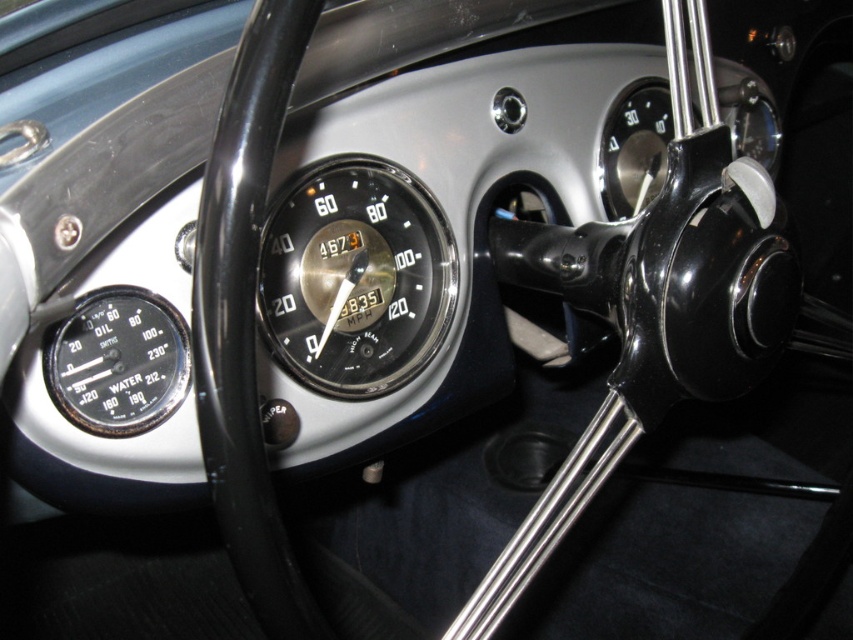
Question: Is shiny chrome speedometer at center bigger than black metallic gauge at left?

Choices:
 (A) no
 (B) yes

Answer: (B)

Question: Which object is farther from the camera taking this photo?

Choices:
 (A) black metallic gauge at left
 (B) shiny chrome speedometer at center

Answer: (B)

Question: Is shiny chrome speedometer at center smaller than black metallic gauge at left?

Choices:
 (A) no
 (B) yes

Answer: (A)

Question: Among these objects, which one is farthest from the camera?

Choices:
 (A) black metallic gauge at left
 (B) shiny chrome speedometer at center

Answer: (B)

Question: Does shiny chrome speedometer at center have a lesser width compared to black metallic gauge at left?

Choices:
 (A) yes
 (B) no

Answer: (B)

Question: Which object appears farthest from the camera in this image?

Choices:
 (A) shiny chrome speedometer at center
 (B) black metallic gauge at left

Answer: (A)